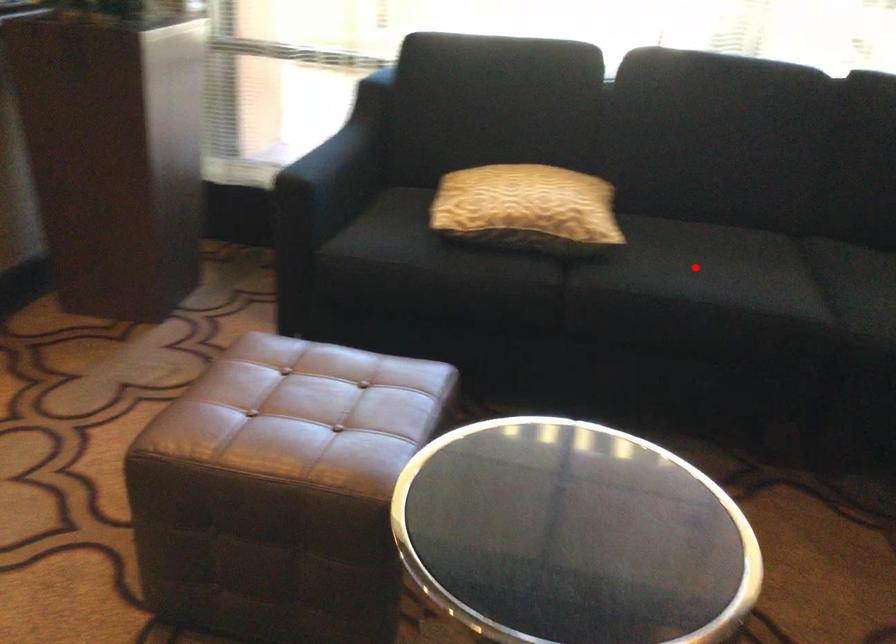
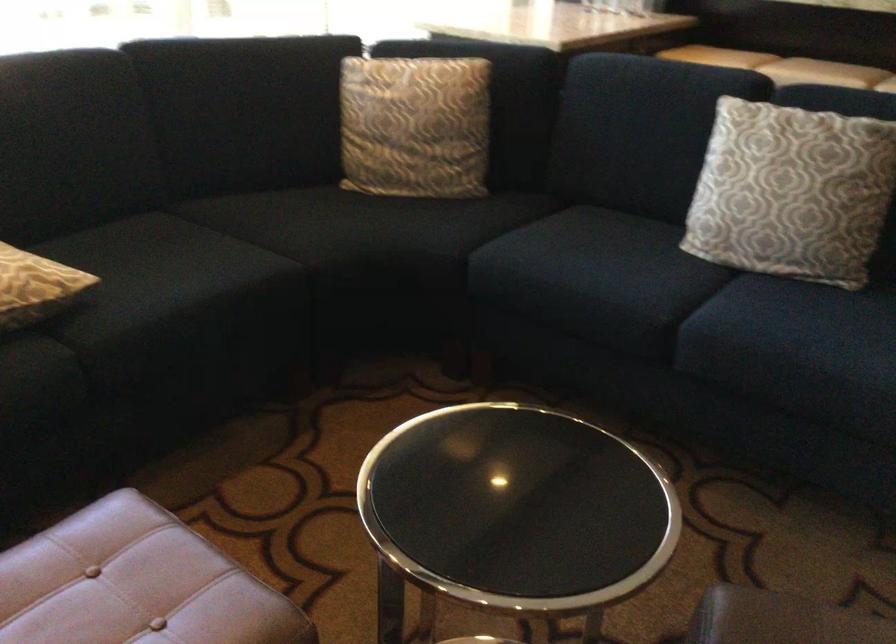
Find the pixel in the second image that matches the highlighted location in the first image.

(161, 270)